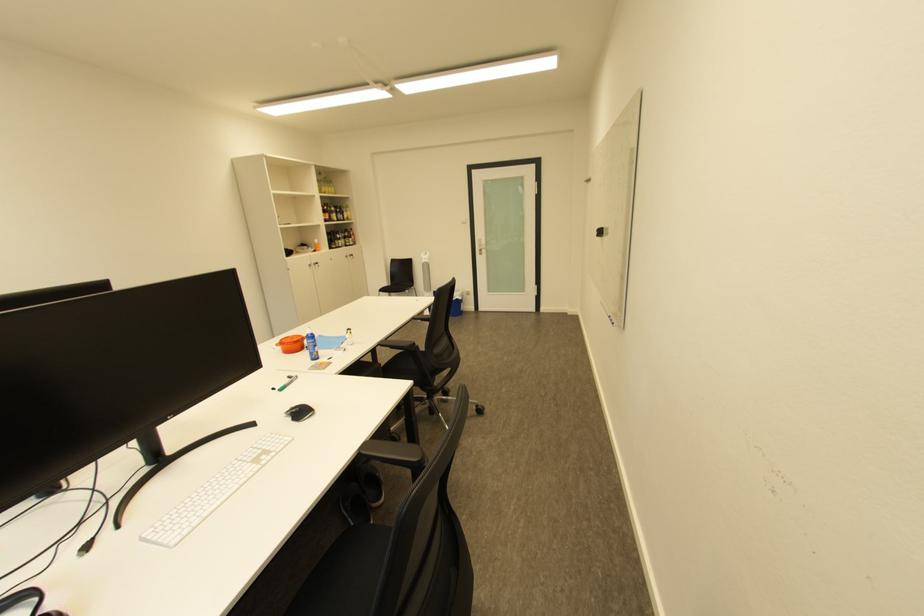
At what (x,y) coordinates should I click in order to perform the action: click on orange plastic bowl. Please return your answer as a coordinate pair (x, y). Looking at the image, I should click on (292, 342).